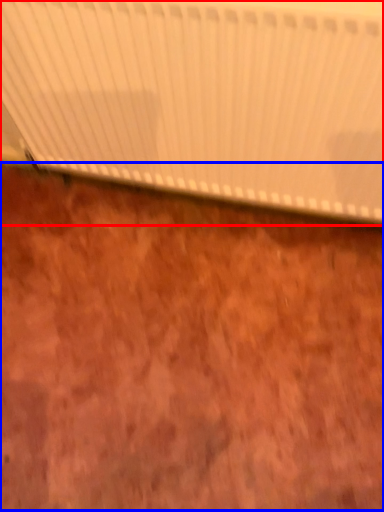
Question: Which point is closer to the camera, curtain (highlighted by a red box) or plywood (highlighted by a blue box)?

Choices:
 (A) curtain
 (B) plywood

Answer: (A)